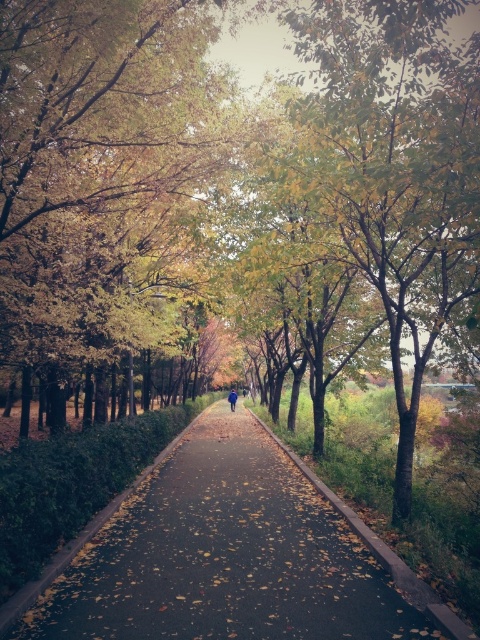
Which is more to the left, golden leaves at center or blue fabric jacket at center?

From the viewer's perspective, golden leaves at center appears more on the left side.

At what (x,y) coordinates should I click in order to perform the action: click on golden leaves at center. Please return your answer as a coordinate pair (x, y). This screenshot has width=480, height=640. Looking at the image, I should click on (103, 168).

Can you confirm if golden leaves at center is positioned below dark asphalt path at center?

Incorrect, golden leaves at center is not positioned below dark asphalt path at center.

From the picture: Does golden leaves at center have a larger size compared to dark asphalt path at center?

Yes, golden leaves at center is bigger than dark asphalt path at center.

Is point (19, 179) closer to camera compared to point (335, 513)?

Yes, it is.

Identify the location of golden leaves at center. Image resolution: width=480 pixels, height=640 pixels. (103, 168).

Which of these two, dark asphalt path at center or blue fabric jacket at center, stands taller?

With more height is blue fabric jacket at center.

Looking at this image, can you confirm if dark asphalt path at center is taller than blue fabric jacket at center?

No.

Is point (129, 570) in front of point (230, 403)?

Yes, point (129, 570) is in front of point (230, 403).

At what (x,y) coordinates should I click in order to perform the action: click on dark asphalt path at center. Please return your answer as a coordinate pair (x, y). The width and height of the screenshot is (480, 640). Looking at the image, I should click on pos(236,556).